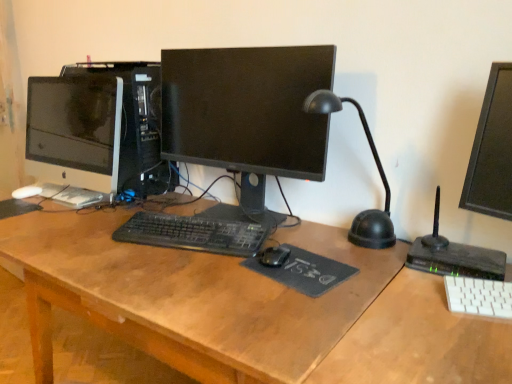
I want to click on vacant space behind black matte mouse at center, so click(x=298, y=231).